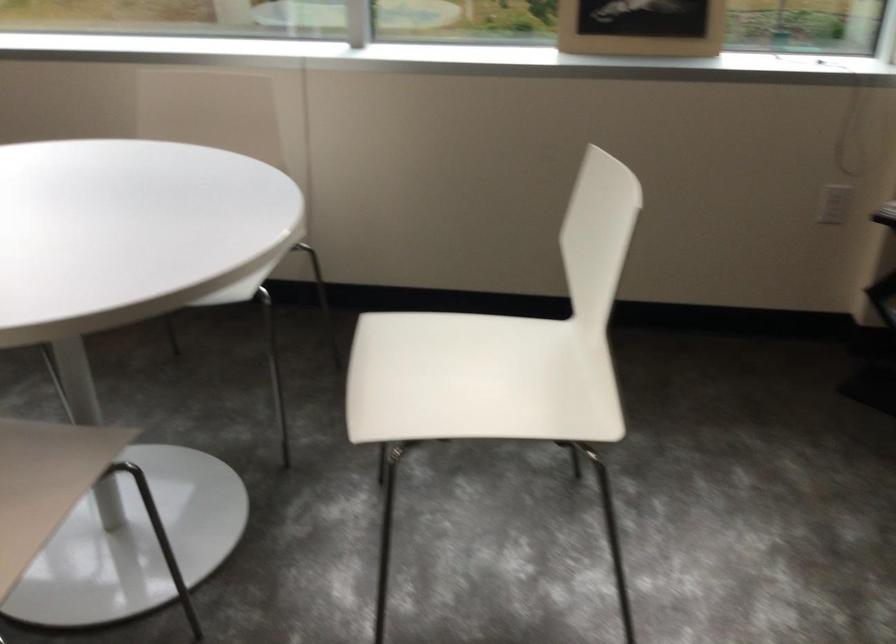
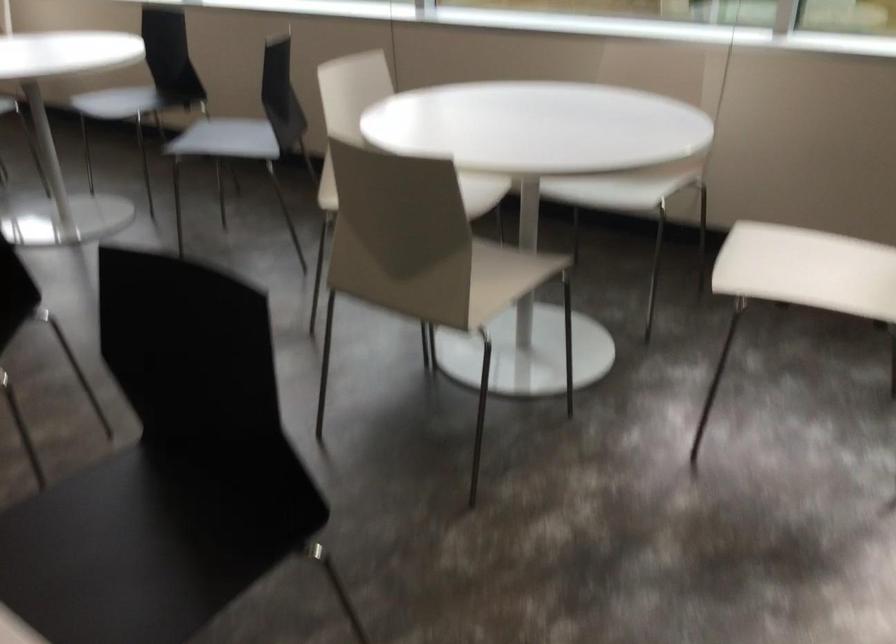
Question: The camera is either moving clockwise (left) or counter-clockwise (right) around the object. The first image is from the beginning of the video and the second image is from the end. Is the camera moving left or right when shooting the video?

Choices:
 (A) Left
 (B) Right

Answer: (B)